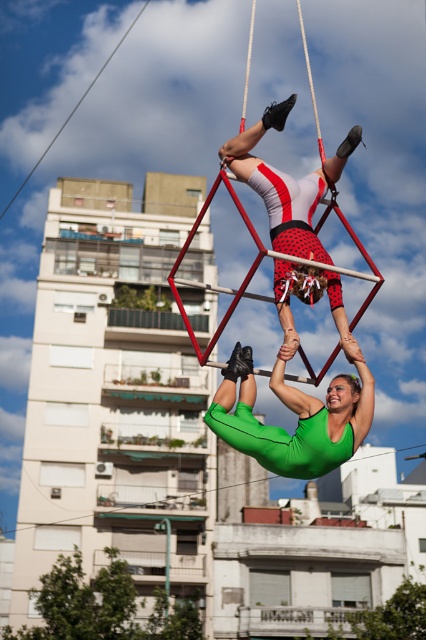
Who is taller, green matte leotard at center or matte red and white leotard at center?

Standing taller between the two is matte red and white leotard at center.

Can you confirm if green matte leotard at center is taller than matte red and white leotard at center?

In fact, green matte leotard at center may be shorter than matte red and white leotard at center.

Between point (365, 433) and point (347, 356), which one is positioned in front?

Point (365, 433)

You are a GUI agent. You are given a task and a screenshot of the screen. Output one action in this format:
    pyautogui.click(x=<x>, y=<y>)
    Task: Click on the green matte leotard at center
    The image size is (426, 640).
    Given the screenshot: What is the action you would take?
    pyautogui.click(x=298, y=420)

Between point (327, 404) and point (187, 326), which one is positioned behind?

The point (187, 326) is behind.

Between point (302, 458) and point (299, 19), which one is positioned behind?

The point (299, 19) is behind.

The image size is (426, 640). Find the location of `green matte leotard at center`. green matte leotard at center is located at coordinates (298, 420).

Does matte red and white leotard at center lie in front of metallic red swing at center?

No, matte red and white leotard at center is behind metallic red swing at center.

Is point (224, 145) positioned behind point (198, 225)?

Yes.

Identify the location of matte red and white leotard at center. Image resolution: width=426 pixels, height=640 pixels. (285, 182).